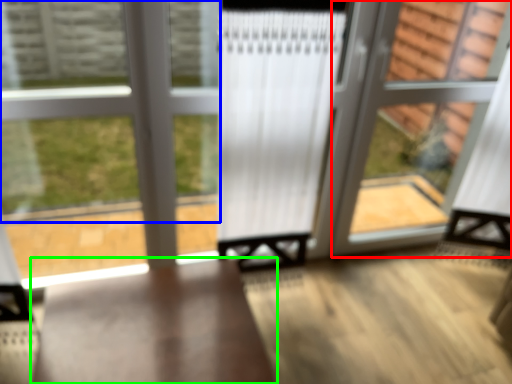
Question: Based on their relative distances, which object is farther from screen door (highlighted by a red box)? Choose from bay window (highlighted by a blue box) and furniture (highlighted by a green box).

Choices:
 (A) bay window
 (B) furniture

Answer: (B)